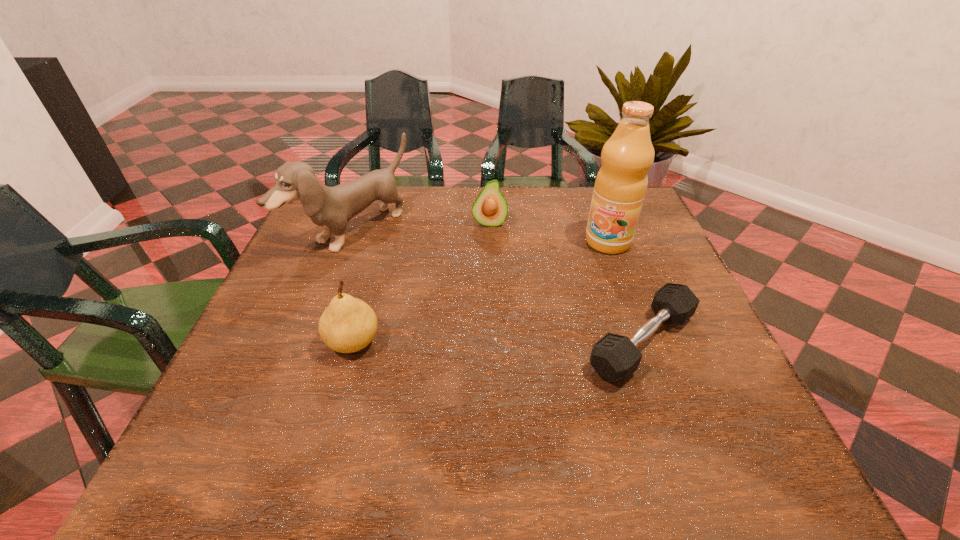
You are a GUI agent. You are given a task and a screenshot of the screen. Output one action in this format:
    pyautogui.click(x=<x>, y=<y>)
    Task: Click on the pear located at the left edge
    Image resolution: width=960 pixels, height=540 pixels.
    Given the screenshot: What is the action you would take?
    pyautogui.click(x=348, y=324)

You are a GUI agent. You are given a task and a screenshot of the screen. Output one action in this format:
    pyautogui.click(x=<x>, y=<y>)
    Task: Click on the puppy that is positioned at the left edge
    The width and height of the screenshot is (960, 540).
    Given the screenshot: What is the action you would take?
    pyautogui.click(x=331, y=208)

Identify the location of dumbbell that is at the right edge. (615, 357).

At what (x,y) coordinates should I click in order to perform the action: click on fruit juice that is positioned at the right edge. Please return your answer as a coordinate pair (x, y). Looking at the image, I should click on (621, 183).

This screenshot has height=540, width=960. What are the coordinates of `object that is at the far left corner` in the screenshot? It's located at (331, 208).

Image resolution: width=960 pixels, height=540 pixels. I want to click on object located at the far right corner, so click(x=621, y=183).

Identify the location of object that is positioned at the near right corner. (615, 357).

Identify the location of vacant space at the far edge. This screenshot has height=540, width=960. (573, 191).

In the image, there is a desktop. Identify the location of vacant space at the near edge. Image resolution: width=960 pixels, height=540 pixels. (402, 390).

This screenshot has height=540, width=960. I want to click on free space at the right edge of the desktop, so [x=702, y=354].